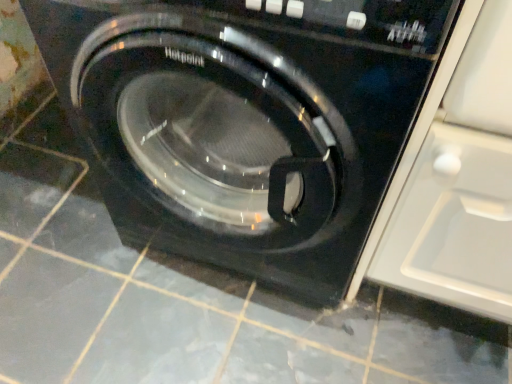
Question: Considering the relative positions of transparent glossy glass door at right and black glossy washing machine at center in the image provided, is transparent glossy glass door at right to the left or to the right of black glossy washing machine at center?

Choices:
 (A) right
 (B) left

Answer: (A)

Question: From the image's perspective, is transparent glossy glass door at right positioned above or below black glossy washing machine at center?

Choices:
 (A) above
 (B) below

Answer: (B)

Question: Considering the positions of transparent glossy glass door at right and black glossy washing machine at center in the image, is transparent glossy glass door at right wider or thinner than black glossy washing machine at center?

Choices:
 (A) wide
 (B) thin

Answer: (B)

Question: Based on their positions, is black glossy washing machine at center located to the left or right of transparent glossy glass door at right?

Choices:
 (A) right
 (B) left

Answer: (B)

Question: Based on their sizes in the image, would you say black glossy washing machine at center is bigger or smaller than transparent glossy glass door at right?

Choices:
 (A) small
 (B) big

Answer: (B)

Question: Is black glossy washing machine at center in front of or behind transparent glossy glass door at right in the image?

Choices:
 (A) behind
 (B) front

Answer: (A)

Question: Is black glossy washing machine at center taller or shorter than transparent glossy glass door at right?

Choices:
 (A) short
 (B) tall

Answer: (B)